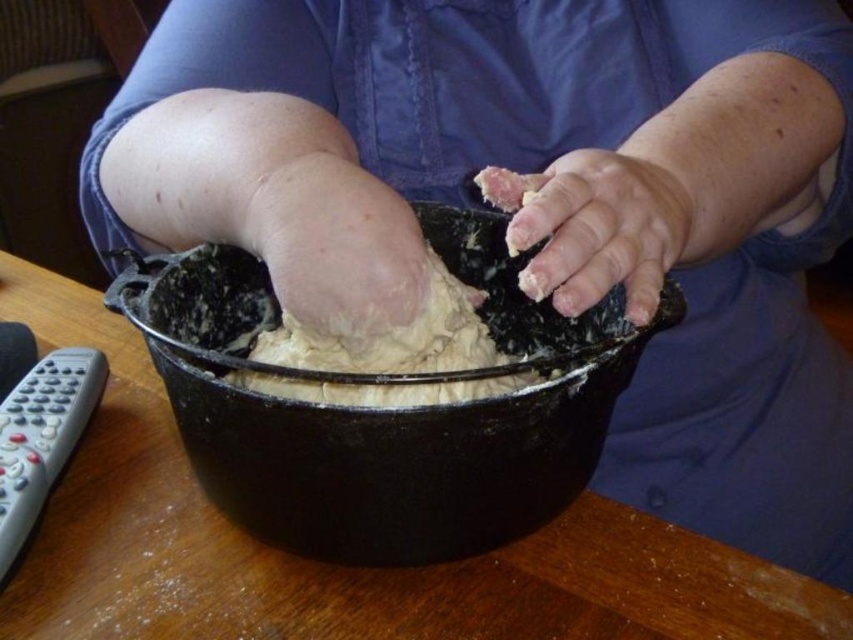
Does black matte bowl at center lie behind pale skin at center?

No, it is in front of pale skin at center.

Does point (280, 500) lie behind point (309, 227)?

Yes.

Between point (347, 518) and point (340, 225), which one is positioned in front?

Positioned in front is point (340, 225).

What are the coordinates of `black matte bowl at center` in the screenshot? It's located at (386, 410).

Can you confirm if pale skin at center is thinner than dry dough at center?

Correct, pale skin at center's width is less than dry dough at center's.

Is pale skin at center to the left of dry dough at center from the viewer's perspective?

Yes, pale skin at center is to the left of dry dough at center.

Is point (292, 291) closer to camera compared to point (570, 236)?

Yes.

Where is `pale skin at center`? The height and width of the screenshot is (640, 853). pale skin at center is located at coordinates (334, 241).

Can you confirm if pale skin at center is shorter than white dough at center?

Incorrect, pale skin at center's height does not fall short of white dough at center's.

Is pale skin at center to the left of white dough at center from the viewer's perspective?

Yes, pale skin at center is to the left of white dough at center.

Locate an element on the screen. The image size is (853, 640). pale skin at center is located at coordinates (334, 241).